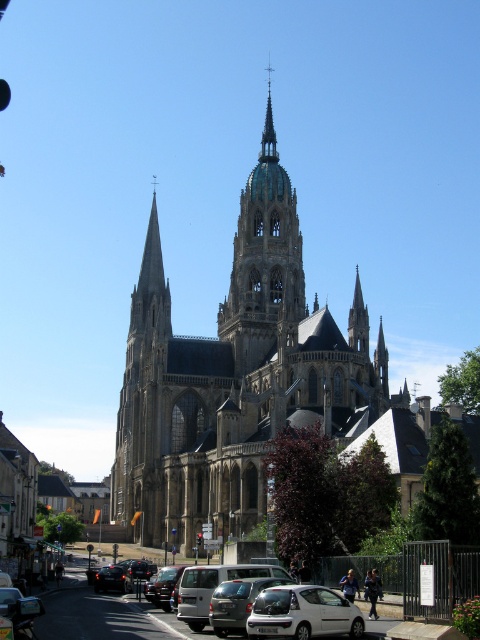
Can you confirm if silver metallic car at lower center is bigger than metallic silver van at center?

Yes.

Between silver metallic car at lower center and metallic silver van at center, which one appears on the right side from the viewer's perspective?

From the viewer's perspective, metallic silver van at center appears more on the right side.

Where is `silver metallic car at lower center`? This screenshot has height=640, width=480. silver metallic car at lower center is located at coordinates 227,579.

Does brown stone church at center have a greater width compared to metallic silver van at center?

Yes.

Does brown stone church at center have a lesser height compared to metallic silver van at center?

In fact, brown stone church at center may be taller than metallic silver van at center.

Is point (189, 417) in front of point (235, 621)?

No, (189, 417) is behind (235, 621).

Locate an element on the screen. brown stone church at center is located at coordinates (233, 376).

Does brown stone church at center appear under smooth gray spire at center?

Correct, brown stone church at center is located below smooth gray spire at center.

Which is more to the left, brown stone church at center or smooth gray spire at center?

brown stone church at center is more to the left.

The image size is (480, 640). What do you see at coordinates (233, 376) in the screenshot?
I see `brown stone church at center` at bounding box center [233, 376].

Where is `brown stone church at center`? Image resolution: width=480 pixels, height=640 pixels. brown stone church at center is located at coordinates (233, 376).